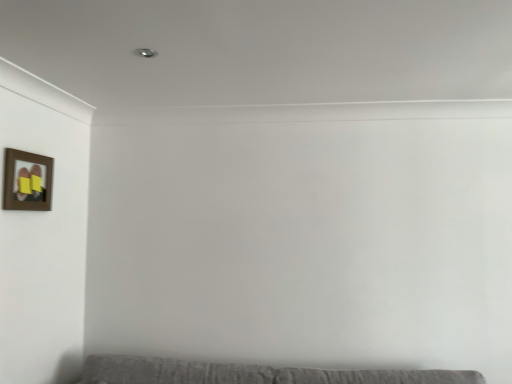
The height and width of the screenshot is (384, 512). What do you see at coordinates (27, 181) in the screenshot?
I see `wooden frame with yellow sticky notes at upper left` at bounding box center [27, 181].

Locate an element on the screen. wooden frame with yellow sticky notes at upper left is located at coordinates (27, 181).

Identify the location of wooden frame with yellow sticky notes at upper left. Image resolution: width=512 pixels, height=384 pixels. (27, 181).